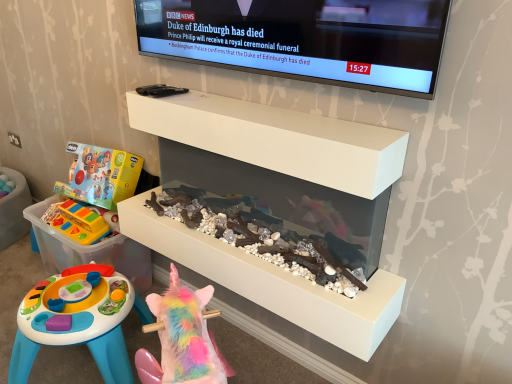
Question: Considering the relative positions of black glossy tv at upper center and white matte shelf at upper center in the image provided, is black glossy tv at upper center to the right of white matte shelf at upper center from the viewer's perspective?

Choices:
 (A) yes
 (B) no

Answer: (A)

Question: From a real-world perspective, is black glossy tv at upper center below white matte shelf at upper center?

Choices:
 (A) no
 (B) yes

Answer: (A)

Question: Is the surface of black glossy tv at upper center in direct contact with white matte shelf at upper center?

Choices:
 (A) no
 (B) yes

Answer: (A)

Question: Is black glossy tv at upper center bigger than white matte shelf at upper center?

Choices:
 (A) yes
 (B) no

Answer: (B)

Question: Does black glossy tv at upper center have a smaller size compared to white matte shelf at upper center?

Choices:
 (A) yes
 (B) no

Answer: (A)

Question: Does black glossy tv at upper center turn towards white matte shelf at upper center?

Choices:
 (A) yes
 (B) no

Answer: (B)

Question: Considering the relative sizes of rainbow plush unicorn at lower center, which is the 2th toy in top-to-bottom order, and white matte shelf at upper center in the image provided, is rainbow plush unicorn at lower center, which is the 2th toy in top-to-bottom order, taller than white matte shelf at upper center?

Choices:
 (A) no
 (B) yes

Answer: (B)

Question: Does rainbow plush unicorn at lower center, acting as the 1th toy starting from the front, appear on the right side of white matte shelf at upper center?

Choices:
 (A) no
 (B) yes

Answer: (A)

Question: Is the surface of rainbow plush unicorn at lower center, which ranks as the second toy in left-to-right order, in direct contact with white matte shelf at upper center?

Choices:
 (A) no
 (B) yes

Answer: (A)

Question: Is rainbow plush unicorn at lower center, which appears as the first toy when viewed from the right, oriented towards white matte shelf at upper center?

Choices:
 (A) yes
 (B) no

Answer: (B)

Question: Can you confirm if rainbow plush unicorn at lower center, acting as the 1th toy starting from the front, is positioned to the left of white matte shelf at upper center?

Choices:
 (A) yes
 (B) no

Answer: (A)

Question: Is rainbow plush unicorn at lower center, acting as the 1th toy starting from the front, behind white matte shelf at upper center?

Choices:
 (A) no
 (B) yes

Answer: (A)

Question: Are white matte shelf at upper center and translucent plastic storage box at lower left located far from each other?

Choices:
 (A) yes
 (B) no

Answer: (B)